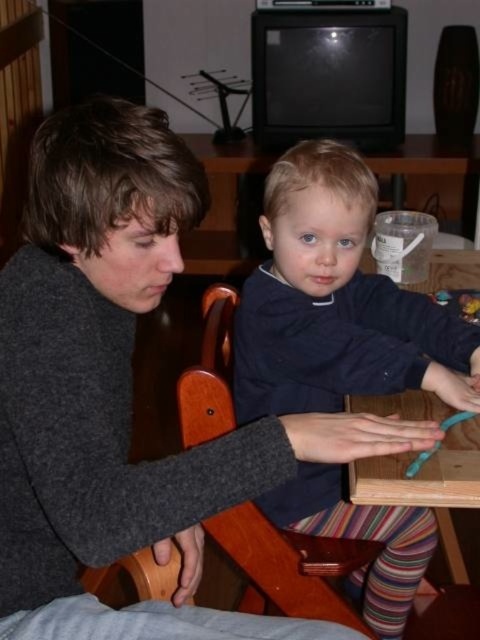
You are a tailor measuring the distance between the dark blue sweater at center and the wooden chair at center for a fitting. The minimum required space for the fitting is 8 inches. Can the fitting be done in this space?

The dark blue sweater at center is 7.90 inches from the wooden chair at center. Since the required space is 8 inches, the fitting cannot be done in this space as there is insufficient clearance.

You are helping organize a playroom and need to place a toy between the dark blue sweater at center and the wooden chair at center. According to the scene, which object should the toy be placed closer to?

The toy should be placed closer to the wooden chair at center because the dark blue sweater at center is to the right of the wooden chair at center, meaning the chair is on the left side relative to the sweater. Therefore, placing the toy between them would require positioning it nearer to the chair to maintain the spatial arrangement.